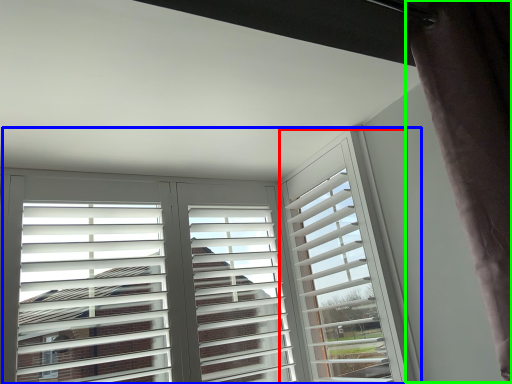
Question: Which object is positioned farthest from window frame (highlighted by a red box)? Select from window (highlighted by a blue box) and curtain (highlighted by a green box).

Choices:
 (A) window
 (B) curtain

Answer: (B)